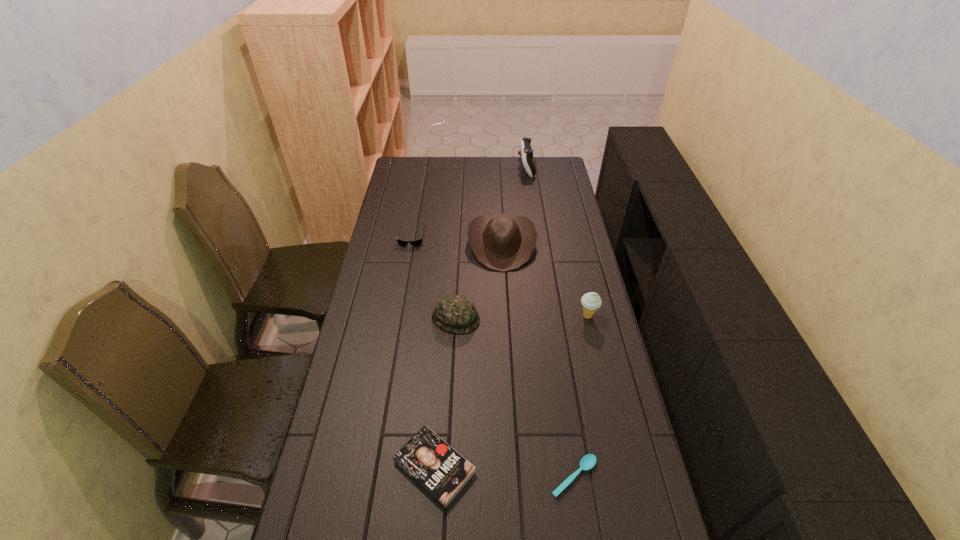
Identify the location of empty location between the control and the cowboy hat. The width and height of the screenshot is (960, 540). (514, 206).

Find the location of `vacant region between the book and the fourth shortest object`. vacant region between the book and the fourth shortest object is located at coordinates (445, 392).

At what (x,y) coordinates should I click in order to perform the action: click on free spot between the farthest object and the sixth tallest object. Please return your answer as a coordinate pair (x, y). Looking at the image, I should click on (480, 317).

What are the coordinates of `free spot between the fourth tallest object and the rightmost object` in the screenshot? It's located at (522, 317).

In order to click on free spot between the shortest object and the book in this screenshot , I will do `click(504, 472)`.

The height and width of the screenshot is (540, 960). In order to click on free area in between the rightmost object and the fourth shortest object in this screenshot , I will do `click(522, 317)`.

At what (x,y) coordinates should I click in order to perform the action: click on object that is the fourth closest to the cowboy hat. Please return your answer as a coordinate pair (x, y). The width and height of the screenshot is (960, 540). Looking at the image, I should click on (526, 152).

Image resolution: width=960 pixels, height=540 pixels. In order to click on object that is the closest to the farthest object in this screenshot , I will do `click(502, 242)`.

This screenshot has height=540, width=960. What are the coordinates of `free location that satisfies the following two spatial constraints: 1. on the front-facing side of the control; 2. on the front side of the book` in the screenshot? It's located at [x=569, y=467].

Locate an element on the screen. free spot that satisfies the following two spatial constraints: 1. on the front-facing side of the control; 2. on the front-facing side of the sunglasses is located at coordinates (536, 237).